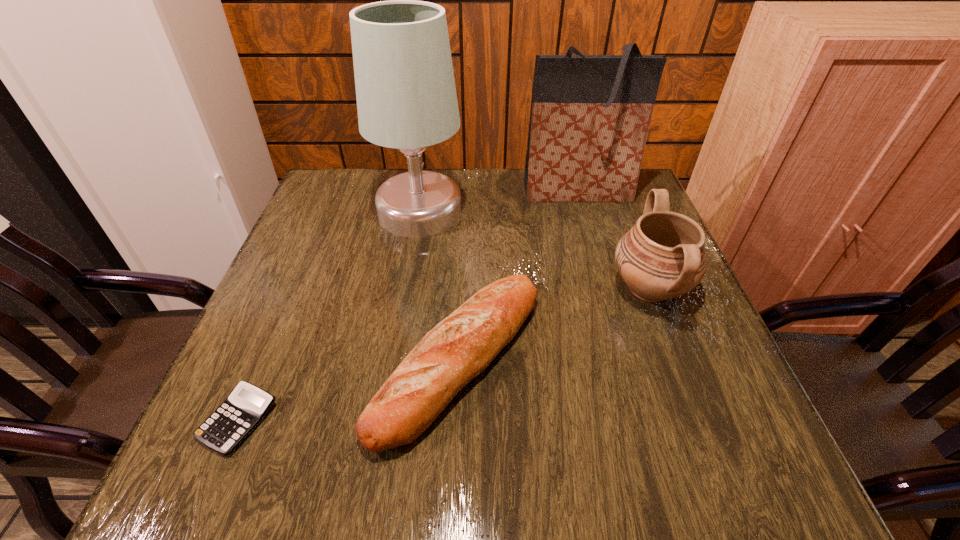
Where is `the tallest object`? The width and height of the screenshot is (960, 540). the tallest object is located at coordinates (406, 97).

Identify the location of shopping bag. (590, 115).

The width and height of the screenshot is (960, 540). Find the location of `urn`. urn is located at coordinates (662, 256).

You are a GUI agent. You are given a task and a screenshot of the screen. Output one action in this format:
    pyautogui.click(x=<x>, y=<y>)
    Task: Click on the fourth tallest object
    Image resolution: width=960 pixels, height=540 pixels.
    Given the screenshot: What is the action you would take?
    pyautogui.click(x=460, y=347)

You are a GUI agent. You are given a task and a screenshot of the screen. Output one action in this format:
    pyautogui.click(x=<x>, y=<y>)
    Task: Click on the shortest object
    This screenshot has height=540, width=960.
    Given the screenshot: What is the action you would take?
    pyautogui.click(x=245, y=407)

Locate an element on the screen. The height and width of the screenshot is (540, 960). calculator is located at coordinates (245, 407).

What are the coordinates of `free space located 0.140m on the base of the lampshade` in the screenshot? It's located at (516, 212).

Where is `blank space located on the front-facing side of the fourth shortest object`? blank space located on the front-facing side of the fourth shortest object is located at coordinates (612, 314).

Identify the location of vacant space located 0.380m on the front-facing side of the third shortest object. The image size is (960, 540). (434, 288).

You are a GUI agent. You are given a task and a screenshot of the screen. Output one action in this format:
    pyautogui.click(x=<x>, y=<y>)
    Task: Click on the vacant space located on the front-facing side of the third shortest object
    This screenshot has height=540, width=960.
    Given the screenshot: What is the action you would take?
    pyautogui.click(x=508, y=288)